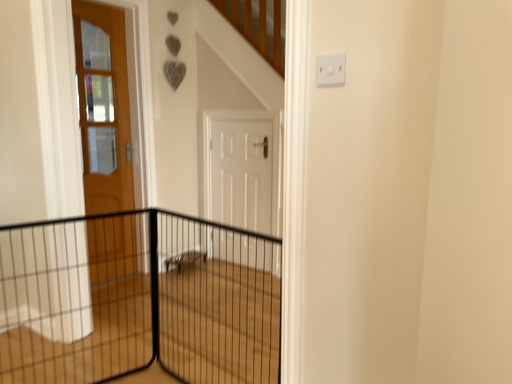
What do you see at coordinates (239, 173) in the screenshot? I see `white matte door at center, which is the first door in right-to-left order` at bounding box center [239, 173].

In order to face white matte door at center, which is the first door in right-to-left order, should I rotate leftwards or rightwards?

Turn left approximately 2.098 degrees to face it.

What do you see at coordinates (137, 300) in the screenshot? The image size is (512, 384). I see `black wire mesh fence at left` at bounding box center [137, 300].

This screenshot has width=512, height=384. What do you see at coordinates (103, 107) in the screenshot?
I see `matte wooden door at left, arranged as the second door when viewed from the right` at bounding box center [103, 107].

This screenshot has width=512, height=384. What are the coordinates of `white matte door at center, which is the 2th door from left to right` in the screenshot? It's located at (239, 173).

Is matte wooden door at left, arranged as the second door when viewed from the right, smaller than white plastic electric outlet at upper right?

Incorrect, matte wooden door at left, arranged as the second door when viewed from the right, is not smaller in size than white plastic electric outlet at upper right.

Can you confirm if matte wooden door at left, which ranks as the 1th door in left-to-right order, is shorter than white plastic electric outlet at upper right?

No.

Would you consider matte wooden door at left, which ranks as the 1th door in left-to-right order, to be distant from white plastic electric outlet at upper right?

Yes.

Is matte wooden door at left, arranged as the second door when viewed from the right, at the left side of white plastic electric outlet at upper right?

Indeed, matte wooden door at left, arranged as the second door when viewed from the right, is positioned on the left side of white plastic electric outlet at upper right.

Based on the photo, considering the sizes of objects matte wooden door at left, arranged as the second door when viewed from the right, and black wire mesh fence at left in the image provided, who is shorter, matte wooden door at left, arranged as the second door when viewed from the right, or black wire mesh fence at left?

black wire mesh fence at left.

Does point (114, 274) come closer to viewer compared to point (98, 273)?

No, it is not.

Is matte wooden door at left, which ranks as the 1th door in left-to-right order, not inside black wire mesh fence at left?

Yes.

Does white plastic electric outlet at upper right come in front of black wire mesh fence at left?

Yes.

Considering the relative positions of white plastic electric outlet at upper right and black wire mesh fence at left in the image provided, is white plastic electric outlet at upper right to the right of black wire mesh fence at left from the viewer's perspective?

Yes, white plastic electric outlet at upper right is to the right of black wire mesh fence at left.

Who is taller, white plastic electric outlet at upper right or black wire mesh fence at left?

With more height is black wire mesh fence at left.

Looking at this image, from a real-world perspective, is white plastic electric outlet at upper right beneath black wire mesh fence at left?

No, from a real-world perspective, white plastic electric outlet at upper right is not below black wire mesh fence at left.

How many degrees apart are the facing directions of white matte door at center, which is the 2th door from left to right, and black wire mesh fence at left?

The facing directions of white matte door at center, which is the 2th door from left to right, and black wire mesh fence at left are 70.7 degrees apart.

In the scene shown: Is white matte door at center, which is the first door in right-to-left order, not inside black wire mesh fence at left?

Yes, white matte door at center, which is the first door in right-to-left order, is located beyond the bounds of black wire mesh fence at left.

Looking at this image, between white matte door at center, which is the first door in right-to-left order, and black wire mesh fence at left, which one is positioned behind?

white matte door at center, which is the first door in right-to-left order, is more distant.

From the image's perspective, is white matte door at center, which is the 2th door from left to right, under black wire mesh fence at left?

Actually, white matte door at center, which is the 2th door from left to right, appears above black wire mesh fence at left in the image.

From a real-world perspective, who is located lower, matte wooden door at left, which ranks as the 1th door in left-to-right order, or white matte door at center, which is the 2th door from left to right?

white matte door at center, which is the 2th door from left to right.

From the image's perspective, would you say matte wooden door at left, which ranks as the 1th door in left-to-right order, is shown under white matte door at center, which is the 2th door from left to right?

Incorrect, from the image's perspective, matte wooden door at left, which ranks as the 1th door in left-to-right order, is higher than white matte door at center, which is the 2th door from left to right.

Is matte wooden door at left, arranged as the second door when viewed from the right, located outside white matte door at center, which is the 2th door from left to right?

Indeed, matte wooden door at left, arranged as the second door when viewed from the right, is completely outside white matte door at center, which is the 2th door from left to right.

Between white plastic electric outlet at upper right and matte wooden door at left, which ranks as the 1th door in left-to-right order, which one has larger width?

matte wooden door at left, which ranks as the 1th door in left-to-right order.

From a real-world perspective, between white plastic electric outlet at upper right and matte wooden door at left, arranged as the second door when viewed from the right, who is vertically higher?

white plastic electric outlet at upper right.

Is white plastic electric outlet at upper right inside or outside of matte wooden door at left, arranged as the second door when viewed from the right?

white plastic electric outlet at upper right is not inside matte wooden door at left, arranged as the second door when viewed from the right, it's outside.

Considering the relative positions of matte wooden door at left, which ranks as the 1th door in left-to-right order, and black wire mesh at center in the image provided, is matte wooden door at left, which ranks as the 1th door in left-to-right order, to the left of black wire mesh at center from the viewer's perspective?

Yes, matte wooden door at left, which ranks as the 1th door in left-to-right order, is to the left of black wire mesh at center.

Considering the relative sizes of matte wooden door at left, which ranks as the 1th door in left-to-right order, and black wire mesh at center in the image provided, is matte wooden door at left, which ranks as the 1th door in left-to-right order, bigger than black wire mesh at center?

No.

Between matte wooden door at left, which ranks as the 1th door in left-to-right order, and black wire mesh at center, which one is positioned behind?

matte wooden door at left, which ranks as the 1th door in left-to-right order, is behind.

The width and height of the screenshot is (512, 384). Find the location of `door that is the 1st object directly below the white plastic electric outlet at upper right (from a real-world perspective)`. door that is the 1st object directly below the white plastic electric outlet at upper right (from a real-world perspective) is located at coordinates (103, 107).

In order to click on door on the left of the black wire mesh fence at left in this screenshot , I will do `click(103, 107)`.

Estimate the real-world distances between objects in this image. Which object is closer to matte wooden door at left, arranged as the second door when viewed from the right, black wire mesh at center or black wire mesh fence at left?

black wire mesh fence at left lies closer to matte wooden door at left, arranged as the second door when viewed from the right, than the other object.

Which object lies further to the anchor point white matte door at center, which is the first door in right-to-left order, white plastic electric outlet at upper right or black wire mesh at center?

The object further to white matte door at center, which is the first door in right-to-left order, is white plastic electric outlet at upper right.

From the image, which object appears to be farther from black wire mesh at center, white plastic electric outlet at upper right or white matte door at center, which is the first door in right-to-left order?

white plastic electric outlet at upper right.

From the image, which object appears to be nearer to black wire mesh at center, matte wooden door at left, which ranks as the 1th door in left-to-right order, or black wire mesh fence at left?

The object closer to black wire mesh at center is black wire mesh fence at left.

Based on their spatial positions, is black wire mesh at center or white matte door at center, which is the first door in right-to-left order, further from matte wooden door at left, arranged as the second door when viewed from the right?

black wire mesh at center is positioned further to the anchor matte wooden door at left, arranged as the second door when viewed from the right.

From the picture: When comparing their distances from black wire mesh fence at left, does black wire mesh at center or matte wooden door at left, arranged as the second door when viewed from the right, seem closer?

black wire mesh at center is positioned closer to the anchor black wire mesh fence at left.

Based on the photo, from the image, which object appears to be farther from black wire mesh at center, white plastic electric outlet at upper right or matte wooden door at left, which ranks as the 1th door in left-to-right order?

white plastic electric outlet at upper right lies further to black wire mesh at center than the other object.

Looking at this image, which object lies nearer to the anchor point matte wooden door at left, arranged as the second door when viewed from the right, black wire mesh fence at left or black wire mesh at center?

Among the two, black wire mesh fence at left is located nearer to matte wooden door at left, arranged as the second door when viewed from the right.

Identify the location of stairwell between white plastic electric outlet at upper right and white matte door at center, which is the first door in right-to-left order, in the front-back direction. (220, 324).

Where is `fence between black wire mesh at center and white matte door at center, which is the first door in right-to-left order, in the front-back direction`? The height and width of the screenshot is (384, 512). fence between black wire mesh at center and white matte door at center, which is the first door in right-to-left order, in the front-back direction is located at coordinates (137, 300).

Find the location of a particular element. fence that lies between white plastic electric outlet at upper right and black wire mesh at center from top to bottom is located at coordinates (137, 300).

This screenshot has height=384, width=512. I want to click on door between black wire mesh at center and white matte door at center, which is the first door in right-to-left order, in the front-back direction, so click(x=103, y=107).